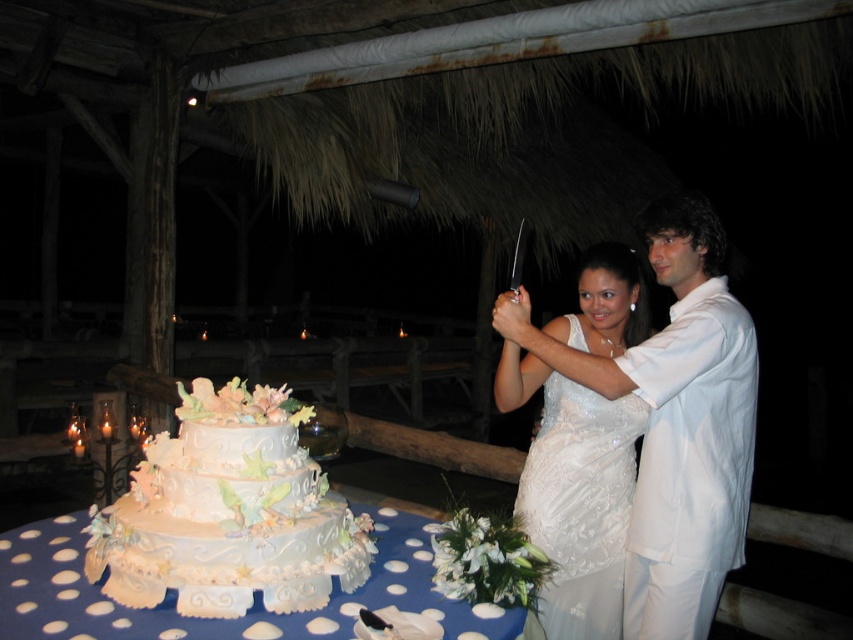
Question: Which point is closer to the camera?

Choices:
 (A) white polka dot fabric at lower center
 (B) white fondant cake at center
 (C) white satin suit at right

Answer: (A)

Question: Does white satin suit at right have a larger size compared to white satin dress at center?

Choices:
 (A) yes
 (B) no

Answer: (B)

Question: Which point is closer to the camera?

Choices:
 (A) (132, 476)
 (B) (634, 493)

Answer: (A)

Question: Considering the real-world distances, which object is farthest from the white satin suit at right?

Choices:
 (A) white fondant cake at center
 (B) white satin dress at center

Answer: (A)

Question: Is white satin suit at right in front of white satin dress at center?

Choices:
 (A) yes
 (B) no

Answer: (A)

Question: In this image, where is white satin suit at right located relative to white polka dot fabric at lower center?

Choices:
 (A) left
 (B) right

Answer: (B)